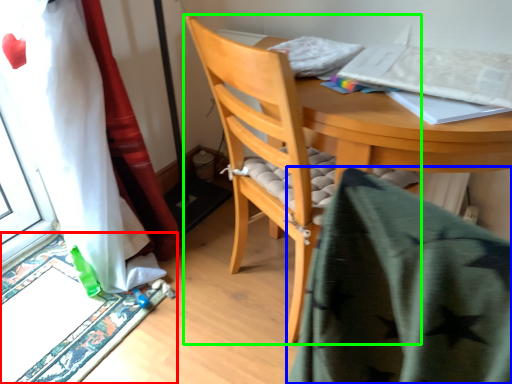
Question: Which object is the farthest from doormat (highlighted by a red box)? Choose among these: blanket (highlighted by a blue box) or chair (highlighted by a green box).

Choices:
 (A) blanket
 (B) chair

Answer: (A)